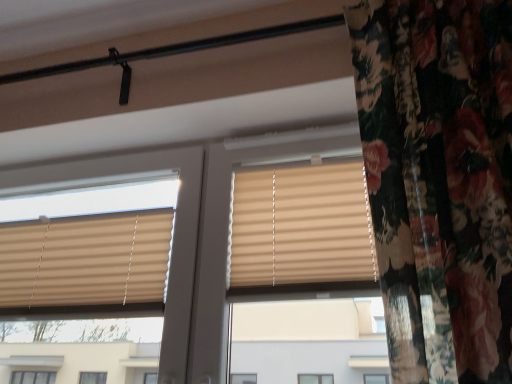
Question: Can you confirm if beige pleated blinds at upper left is wider than beige fabric blinds at center?

Choices:
 (A) yes
 (B) no

Answer: (A)

Question: From the image's perspective, is beige pleated blinds at upper left below beige fabric blinds at center?

Choices:
 (A) yes
 (B) no

Answer: (A)

Question: Is beige pleated blinds at upper left to the left of beige fabric blinds at center from the viewer's perspective?

Choices:
 (A) no
 (B) yes

Answer: (B)

Question: Does beige pleated blinds at upper left turn towards beige fabric blinds at center?

Choices:
 (A) yes
 (B) no

Answer: (B)

Question: From the image's perspective, is beige pleated blinds at upper left on top of beige fabric blinds at center?

Choices:
 (A) yes
 (B) no

Answer: (B)

Question: From a real-world perspective, does beige pleated blinds at upper left sit lower than beige fabric blinds at center?

Choices:
 (A) no
 (B) yes

Answer: (B)

Question: Is beige fabric blinds at center surrounding beige pleated blinds at upper left?

Choices:
 (A) no
 (B) yes

Answer: (A)

Question: From a real-world perspective, is beige fabric blinds at center physically below beige pleated blinds at upper left?

Choices:
 (A) yes
 (B) no

Answer: (B)

Question: Is beige fabric blinds at center at the right side of beige pleated blinds at upper left?

Choices:
 (A) yes
 (B) no

Answer: (A)

Question: Can you confirm if beige fabric blinds at center is wider than beige pleated blinds at upper left?

Choices:
 (A) no
 (B) yes

Answer: (A)

Question: Are beige fabric blinds at center and beige pleated blinds at upper left making contact?

Choices:
 (A) yes
 (B) no

Answer: (B)

Question: Does beige fabric blinds at center have a lesser height compared to beige pleated blinds at upper left?

Choices:
 (A) yes
 (B) no

Answer: (B)

Question: Looking at the image, does beige fabric blinds at center seem bigger or smaller compared to beige pleated blinds at upper left?

Choices:
 (A) small
 (B) big

Answer: (A)